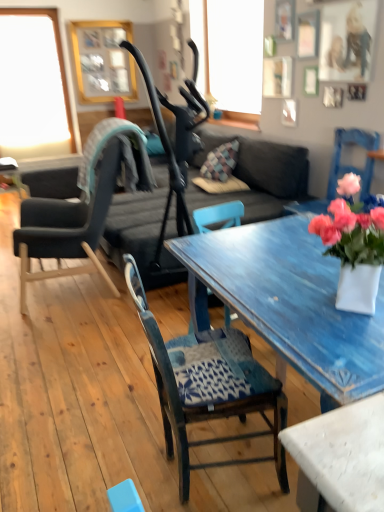
Identify the location of free space above gold wooden picture frame at upper center (from a real-world perspective). (101, 18).